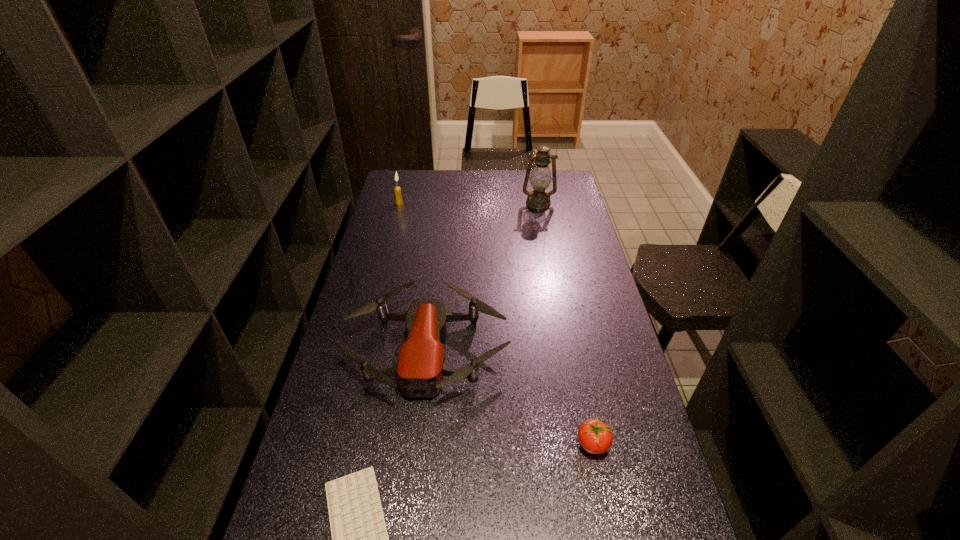
At what (x,y) coordinates should I click in order to perform the action: click on candle at the left edge. Please return your answer as a coordinate pair (x, y). Looking at the image, I should click on (397, 190).

Find the location of a particular element. The width and height of the screenshot is (960, 540). drone that is at the left edge is located at coordinates (420, 368).

I want to click on oil lamp located at the right edge, so click(x=540, y=179).

Image resolution: width=960 pixels, height=540 pixels. I want to click on tomato at the right edge, so (x=595, y=437).

Image resolution: width=960 pixels, height=540 pixels. In order to click on vacant space at the far edge of the desktop in this screenshot , I will do `click(469, 194)`.

In the image, there is a desktop. Where is `vacant region at the left edge`? This screenshot has height=540, width=960. vacant region at the left edge is located at coordinates (346, 363).

Locate an element on the screen. This screenshot has width=960, height=540. vacant space at the right edge is located at coordinates (612, 334).

Identify the location of vacant area at the far left corner. (400, 181).

This screenshot has width=960, height=540. What are the coordinates of `free spot between the second nearest object and the fourth shortest object` in the screenshot? It's located at (496, 324).

Where is `empty space between the candle and the third nearest object`? Image resolution: width=960 pixels, height=540 pixels. empty space between the candle and the third nearest object is located at coordinates (413, 276).